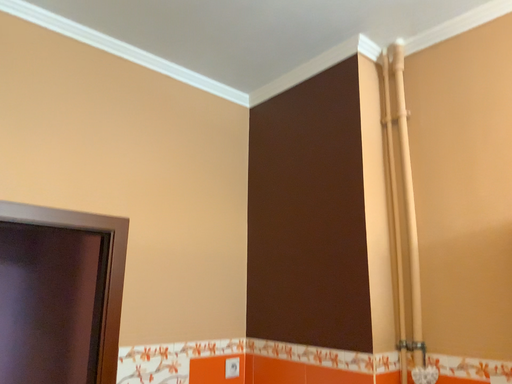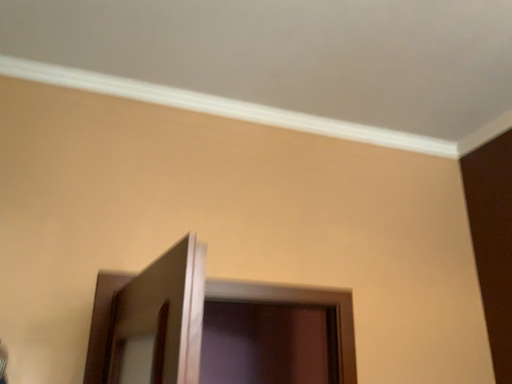
Question: Which way did the camera rotate in the video?

Choices:
 (A) rotated upward
 (B) rotated downward

Answer: (A)